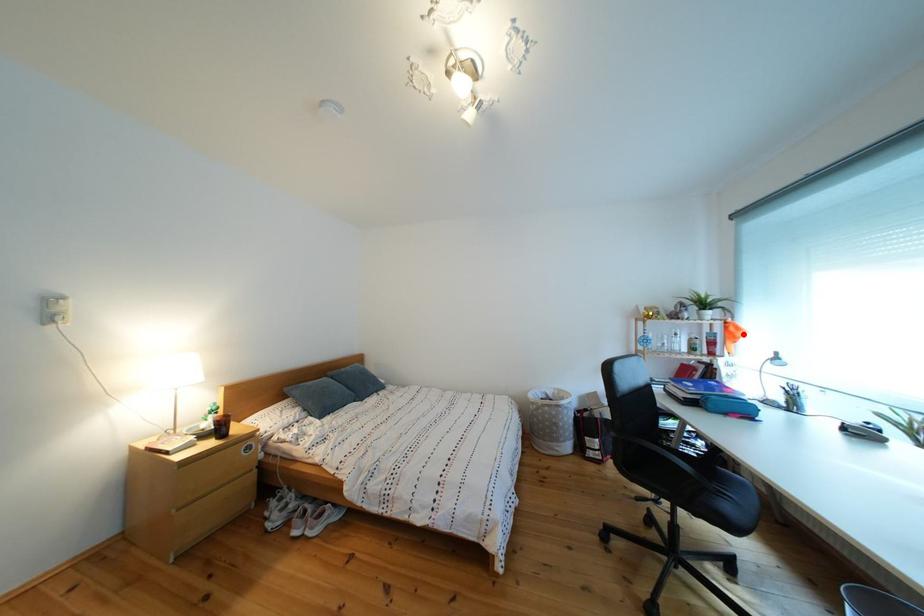
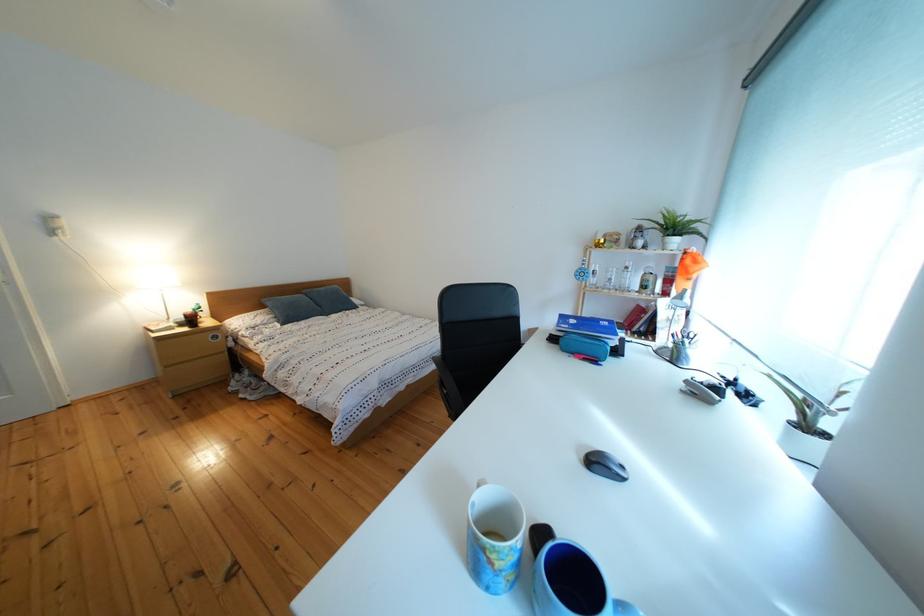
Question: I am providing you with two images of the same scene from different viewpoints. A red point is marked on the first image. Can you still see the location of the red point in image 2?

Choices:
 (A) Yes
 (B) No

Answer: (A)